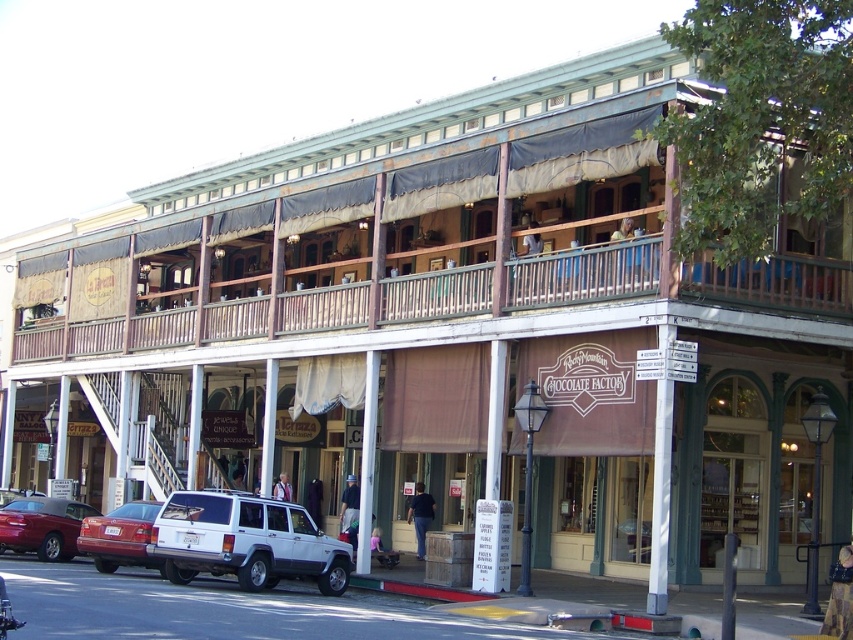
Question: Can you confirm if white matte suv at center is positioned to the right of matte red car at lower left?

Choices:
 (A) yes
 (B) no

Answer: (A)

Question: Does brown wooden balcony at upper center have a larger size compared to metallic silver suv at lower left?

Choices:
 (A) no
 (B) yes

Answer: (B)

Question: Which is nearer to the brown wooden balcony at upper center?

Choices:
 (A) white matte suv at center
 (B) matte red car at lower left
 (C) metallic silver suv at lower left

Answer: (A)

Question: Is metallic silver suv at lower left positioned before matte red car at lower left?

Choices:
 (A) yes
 (B) no

Answer: (B)

Question: Which point is farther from the camera taking this photo?

Choices:
 (A) (437, 300)
 (B) (51, 506)
 (C) (125, 518)

Answer: (B)

Question: Based on their relative distances, which object is nearer to the white matte suv at center?

Choices:
 (A) matte red car at lower left
 (B) brown wooden balcony at upper center

Answer: (A)